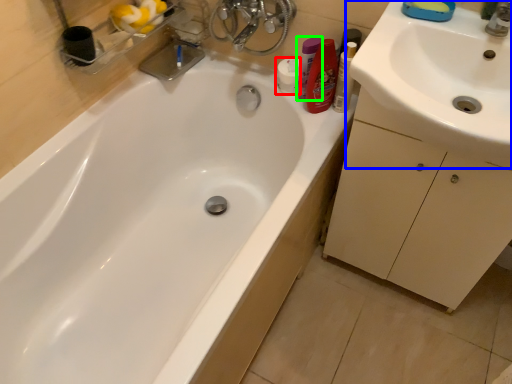
Question: Which is nearer to the toiletry (highlighted by a red box)? sink (highlighted by a blue box) or toiletry (highlighted by a green box).

Choices:
 (A) sink
 (B) toiletry

Answer: (B)